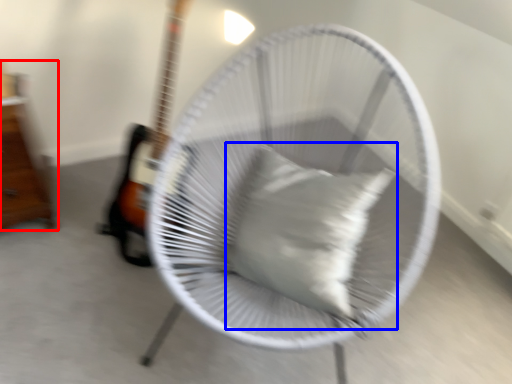
Question: Among these objects, which one is farthest to the camera, furniture (highlighted by a red box) or pillow (highlighted by a blue box)?

Choices:
 (A) furniture
 (B) pillow

Answer: (A)